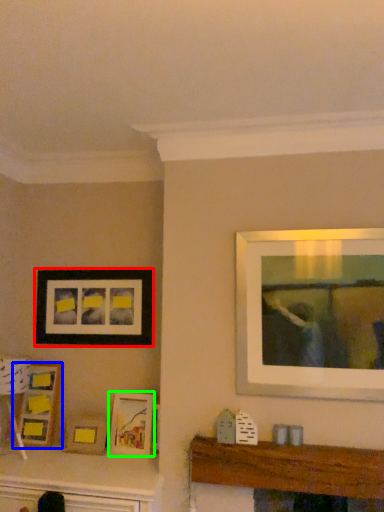
Question: Based on their relative distances, which object is farther from picture frame (highlighted by a red box)? Choose from picture frame (highlighted by a blue box) and picture frame (highlighted by a green box).

Choices:
 (A) picture frame
 (B) picture frame

Answer: (B)